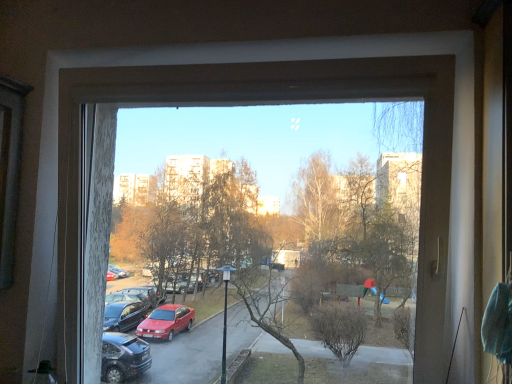
The height and width of the screenshot is (384, 512). In order to click on transparent glass window at center in this screenshot , I will do coord(329,101).

What is the approximate height of transparent glass window at center?

The height of transparent glass window at center is 1.25 meters.

What do you see at coordinates (329, 101) in the screenshot? I see `transparent glass window at center` at bounding box center [329, 101].

Find the location of a particular element. transparent glass window at center is located at coordinates (329, 101).